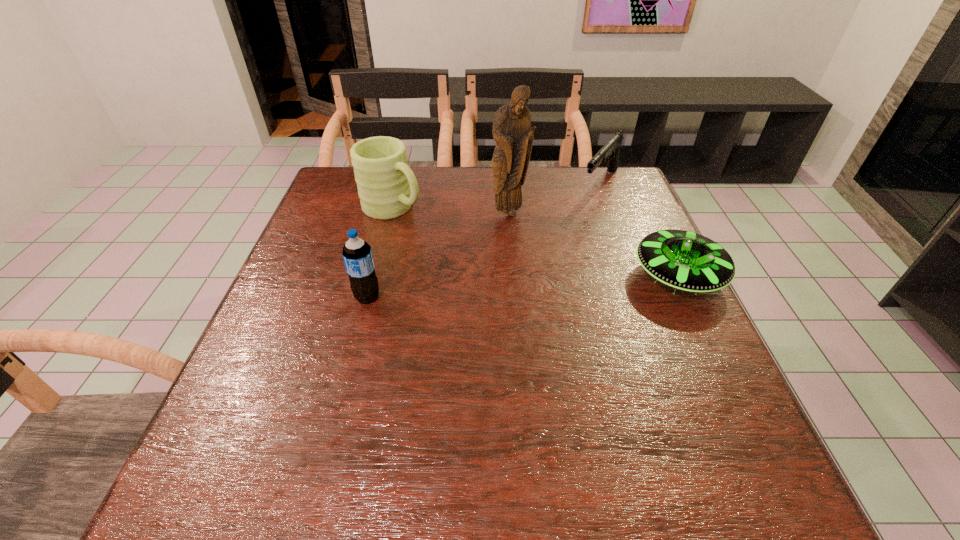
The width and height of the screenshot is (960, 540). I want to click on object present at the left edge, so click(387, 187).

Find the location of a particular element. saucer that is positioned at the right edge is located at coordinates (686, 261).

Where is `gun located in the right edge section of the desktop`? Image resolution: width=960 pixels, height=540 pixels. gun located in the right edge section of the desktop is located at coordinates (610, 151).

What are the coordinates of `object at the far left corner` in the screenshot? It's located at (387, 187).

Locate an element on the screen. Image resolution: width=960 pixels, height=540 pixels. object situated at the far right corner is located at coordinates (610, 151).

The height and width of the screenshot is (540, 960). What are the coordinates of `vacant area at the far edge` in the screenshot? It's located at (451, 187).

Where is `free region at the near edge of the desktop`? This screenshot has height=540, width=960. free region at the near edge of the desktop is located at coordinates (636, 439).

In the image, there is a desktop. Identify the location of vacant space at the left edge. (295, 364).

Locate an element on the screen. This screenshot has width=960, height=540. vacant space at the right edge of the desktop is located at coordinates (593, 220).

Image resolution: width=960 pixels, height=540 pixels. What are the coordinates of `vacant space at the near left corner` in the screenshot? It's located at [x=291, y=413].